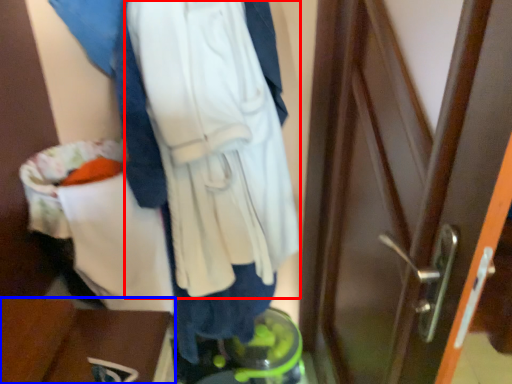
Question: Among these objects, which one is farthest to the camera, sweatshirt (highlighted by a red box) or furniture (highlighted by a blue box)?

Choices:
 (A) sweatshirt
 (B) furniture

Answer: (B)